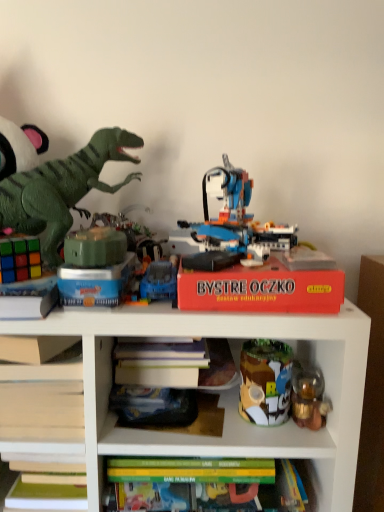
What do you see at coordinates (309, 397) in the screenshot? This screenshot has width=384, height=512. I see `gold metallic lantern at right, the 7th toy from the left` at bounding box center [309, 397].

What do you see at coordinates (261, 289) in the screenshot? I see `red matte board game at center` at bounding box center [261, 289].

The height and width of the screenshot is (512, 384). Find the location of `translucent plastic robot at center, arranged as the 5th toy when viewed from the left`. translucent plastic robot at center, arranged as the 5th toy when viewed from the left is located at coordinates (233, 225).

What is the approximate width of blue plastic toy car at center, acting as the fourth toy starting from the left?

It is 3.94 inches.

In order to face green plastic dinosaur at left, marked as the second toy in a left-to-right arrangement, should I rotate leftwards or rightwards?

You should look left and rotate roughly 18.695 degrees.

Locate an element on the screen. green plastic dinosaur at left, which is the sixth toy from right to left is located at coordinates (62, 188).

In order to click on red cardboard box at upper center in this screenshot , I will do [x=229, y=393].

Find the location of a particular element. Image resolution: width=384 pixels, height=512 pixels. metallic tin can at center right, the 2th toy when ordered from right to left is located at coordinates (265, 381).

You are a GUI agent. You are given a task and a screenshot of the screen. Output one action in this format:
    pyautogui.click(x=<x>, y=<y>)
    Task: Click on the gold metallic lantern at right, the 7th toy from the left
    The width and height of the screenshot is (384, 512).
    Given the screenshot: What is the action you would take?
    pyautogui.click(x=309, y=397)

From the image's perspective, would you say rubberized plastic rubik's cube at left, positioned as the 1th toy in left-to-right order, is positioned over green matte cube at center, placed as the third toy when sorted from left to right?

No, from the image's perspective, rubberized plastic rubik's cube at left, positioned as the 1th toy in left-to-right order, is not above green matte cube at center, placed as the third toy when sorted from left to right.

Is rubberized plastic rubik's cube at left, positioned as the 1th toy in left-to-right order, not within green matte cube at center, arranged as the fifth toy when viewed from the right?

rubberized plastic rubik's cube at left, positioned as the 1th toy in left-to-right order, lies outside green matte cube at center, arranged as the fifth toy when viewed from the right,'s area.

In the scene shown: Is rubberized plastic rubik's cube at left, positioned as the 1th toy in left-to-right order, bigger than green matte cube at center, arranged as the fifth toy when viewed from the right?

Incorrect, rubberized plastic rubik's cube at left, positioned as the 1th toy in left-to-right order, is not larger than green matte cube at center, arranged as the fifth toy when viewed from the right.

How different are the orientations of rubberized plastic rubik's cube at left, the seventh toy when ordered from right to left, and green matte cube at center, placed as the third toy when sorted from left to right, in degrees?

The angle between the facing direction of rubberized plastic rubik's cube at left, the seventh toy when ordered from right to left, and the facing direction of green matte cube at center, placed as the third toy when sorted from left to right, is 44.4 degrees.

Measure the distance between rubberized plastic rubik's cube at left, positioned as the 1th toy in left-to-right order, and green plastic dinosaur at left, which is the sixth toy from right to left.

The distance of rubberized plastic rubik's cube at left, positioned as the 1th toy in left-to-right order, from green plastic dinosaur at left, which is the sixth toy from right to left, is 6.18 inches.

From a real-world perspective, is rubberized plastic rubik's cube at left, positioned as the 1th toy in left-to-right order, physically above green plastic dinosaur at left, which is the sixth toy from right to left?

No, from a real-world perspective, rubberized plastic rubik's cube at left, positioned as the 1th toy in left-to-right order, is not above green plastic dinosaur at left, which is the sixth toy from right to left.

Can you confirm if rubberized plastic rubik's cube at left, the seventh toy when ordered from right to left, is taller than green plastic dinosaur at left, marked as the second toy in a left-to-right arrangement?

Incorrect, the height of rubberized plastic rubik's cube at left, the seventh toy when ordered from right to left, is not larger of that of green plastic dinosaur at left, marked as the second toy in a left-to-right arrangement.

Is rubberized plastic rubik's cube at left, the seventh toy when ordered from right to left, completely or partially outside of green plastic dinosaur at left, marked as the second toy in a left-to-right arrangement?

No, rubberized plastic rubik's cube at left, the seventh toy when ordered from right to left, is not outside of green plastic dinosaur at left, marked as the second toy in a left-to-right arrangement.

Between gold metallic lantern at right, marked as the first toy in a right-to-left arrangement, and translucent plastic robot at center, arranged as the 5th toy when viewed from the left, which one has larger size?

translucent plastic robot at center, arranged as the 5th toy when viewed from the left, is bigger.

How many degrees apart are the facing directions of gold metallic lantern at right, marked as the first toy in a right-to-left arrangement, and translucent plastic robot at center, arranged as the 5th toy when viewed from the left?

0.271 degrees.

Does point (298, 373) come farther from viewer compared to point (214, 262)?

Yes, it is behind point (214, 262).

Is gold metallic lantern at right, the 7th toy from the left, shorter than translucent plastic robot at center, arranged as the 5th toy when viewed from the left?

Yes, gold metallic lantern at right, the 7th toy from the left, is shorter than translucent plastic robot at center, arranged as the 5th toy when viewed from the left.

Is metallic tin can at center right, which appears as the 6th toy when viewed from the left, facing towards red matte board game at center?

No, metallic tin can at center right, which appears as the 6th toy when viewed from the left, does not turn towards red matte board game at center.

This screenshot has width=384, height=512. I want to click on toy that is the 1st one when counting downward from the red matte board game at center (from the image's perspective), so click(265, 381).

From the image's perspective, does metallic tin can at center right, the 2th toy when ordered from right to left, appear higher than red matte board game at center?

Incorrect, from the image's perspective, metallic tin can at center right, the 2th toy when ordered from right to left, is lower than red matte board game at center.

Is green plastic dinosaur at left, which is the sixth toy from right to left, next to blue plastic toy car at center, acting as the fourth toy starting from the left, and touching it?

No, green plastic dinosaur at left, which is the sixth toy from right to left, is not next to blue plastic toy car at center, acting as the fourth toy starting from the left.

From the image's perspective, is green plastic dinosaur at left, marked as the second toy in a left-to-right arrangement, located beneath blue plastic toy car at center, arranged as the 4th toy when viewed from the right?

Actually, green plastic dinosaur at left, marked as the second toy in a left-to-right arrangement, appears above blue plastic toy car at center, arranged as the 4th toy when viewed from the right, in the image.

Looking at their sizes, would you say green plastic dinosaur at left, which is the sixth toy from right to left, is wider or thinner than blue plastic toy car at center, arranged as the 4th toy when viewed from the right?

Considering their sizes, green plastic dinosaur at left, which is the sixth toy from right to left, looks broader than blue plastic toy car at center, arranged as the 4th toy when viewed from the right.

Which of these two, green plastic dinosaur at left, marked as the second toy in a left-to-right arrangement, or red cardboard box at upper center, is bigger?

Bigger between the two is red cardboard box at upper center.

Is green plastic dinosaur at left, which is the sixth toy from right to left, not close to red cardboard box at upper center?

They are positioned close to each other.

This screenshot has height=512, width=384. I want to click on shelf behind the green plastic dinosaur at left, marked as the second toy in a left-to-right arrangement, so click(229, 393).

Which is further, (140, 291) or (114, 240)?

The point (140, 291) is farther from the camera.

In the scene shown: Is green matte cube at center, placed as the third toy when sorted from left to right, inside blue plastic toy car at center, acting as the fourth toy starting from the left?

That's incorrect, green matte cube at center, placed as the third toy when sorted from left to right, is not inside blue plastic toy car at center, acting as the fourth toy starting from the left.

From a real-world perspective, which toy is the 1st one underneath the green matte cube at center, placed as the third toy when sorted from left to right? Please provide its 2D coordinates.

[(19, 259)]

You are a GUI agent. You are given a task and a screenshot of the screen. Output one action in this format:
    pyautogui.click(x=<x>, y=<y>)
    Task: Click on the 2nd toy behind the green plastic dinosaur at left, marked as the second toy in a left-to-right arrangement, counting from the anchor's position
    Image resolution: width=384 pixels, height=512 pixels.
    Given the screenshot: What is the action you would take?
    (19, 259)

Based on their spatial positions, is red cardboard box at upper center or red matte board game at center closer to green plastic dinosaur at left, which is the sixth toy from right to left?

red matte board game at center.

Considering their positions, is gold metallic lantern at right, the 7th toy from the left, positioned further to metallic tin can at center right, the 2th toy when ordered from right to left, than blue plastic toy car at center, arranged as the 4th toy when viewed from the right?

Among the two, blue plastic toy car at center, arranged as the 4th toy when viewed from the right, is located further to metallic tin can at center right, the 2th toy when ordered from right to left.

Which object lies further to the anchor point red cardboard box at upper center, rubberized plastic rubik's cube at left, the seventh toy when ordered from right to left, or blue plastic toy car at center, acting as the fourth toy starting from the left?

rubberized plastic rubik's cube at left, the seventh toy when ordered from right to left, is further to red cardboard box at upper center.

Considering their positions, is green matte cube at center, placed as the third toy when sorted from left to right, positioned further to red matte board game at center than gold metallic lantern at right, marked as the first toy in a right-to-left arrangement?

The object further to red matte board game at center is gold metallic lantern at right, marked as the first toy in a right-to-left arrangement.

Consider the image. When comparing their distances from red matte board game at center, does translucent plastic robot at center, arranged as the 5th toy when viewed from the left, or rubberized plastic rubik's cube at left, the seventh toy when ordered from right to left, seem closer?

The object closer to red matte board game at center is translucent plastic robot at center, arranged as the 5th toy when viewed from the left.

Which object lies nearer to the anchor point red matte board game at center, gold metallic lantern at right, the 7th toy from the left, or translucent plastic robot at center, arranged as the third toy when viewed from the right?

Among the two, translucent plastic robot at center, arranged as the third toy when viewed from the right, is located nearer to red matte board game at center.

Looking at the image, which one is located further to green plastic dinosaur at left, marked as the second toy in a left-to-right arrangement, green matte cube at center, placed as the third toy when sorted from left to right, or red matte board game at center?

Based on the image, red matte board game at center appears to be further to green plastic dinosaur at left, marked as the second toy in a left-to-right arrangement.

Which object lies further to the anchor point gold metallic lantern at right, the 7th toy from the left, metallic tin can at center right, which appears as the 6th toy when viewed from the left, or green plastic dinosaur at left, marked as the second toy in a left-to-right arrangement?

Among the two, green plastic dinosaur at left, marked as the second toy in a left-to-right arrangement, is located further to gold metallic lantern at right, the 7th toy from the left.

Locate an element on the screen. book between green plastic dinosaur at left, marked as the second toy in a left-to-right arrangement, and gold metallic lantern at right, the 7th toy from the left is located at coordinates (261, 289).

I want to click on shelf located between rubberized plastic rubik's cube at left, the seventh toy when ordered from right to left, and gold metallic lantern at right, the 7th toy from the left, in the left-right direction, so click(x=229, y=393).

I want to click on book that lies between translucent plastic robot at center, arranged as the third toy when viewed from the right, and metallic tin can at center right, which appears as the 6th toy when viewed from the left, from top to bottom, so click(x=261, y=289).

Locate an element on the screen. book between blue plastic toy car at center, acting as the fourth toy starting from the left, and gold metallic lantern at right, the 7th toy from the left, in the horizontal direction is located at coordinates (261, 289).